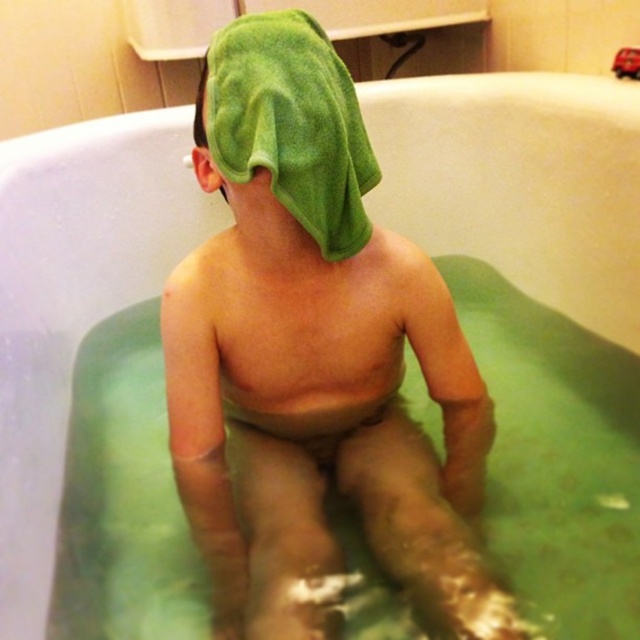
Between green towel at back and green soft towel at back, which one appears on the right side from the viewer's perspective?

green towel at back

Is green towel at back in front of green soft towel at back?

That is False.

Is point (301, 420) in front of point (292, 72)?

No, (301, 420) is further to viewer.

Where is `green towel at back`? The width and height of the screenshot is (640, 640). green towel at back is located at coordinates (317, 348).